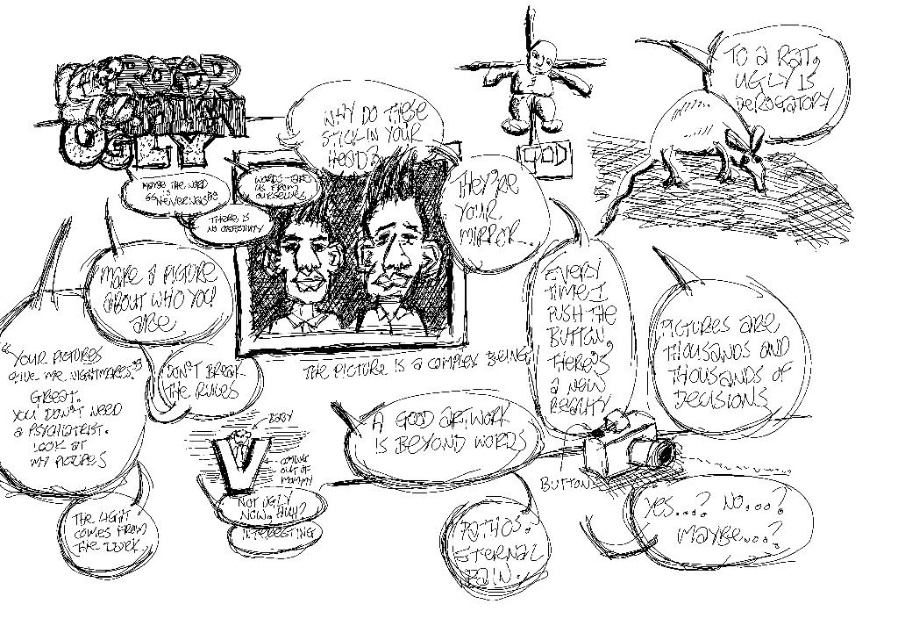
Based on the scene description, what is located at the coordinates point (x=395, y=244)?

The point (x=395, y=244) corresponds to the grayscale sketch portrait at center.

You are an artist analyzing the sketch. You notice two points marked in the image. The first point is at coordinates point (x=417, y=196) and the second is at point (x=275, y=269). Which point is closer to the viewer?

Point (x=417, y=196) is further to the viewer than point (x=275, y=269), so the second point is closer.

You are an art student analyzing the sketch. You need to locate the grayscale sketch portrait at center. According to the coordinates provided, where exactly is it positioned?

The grayscale sketch portrait at center is located at point coordinates 0.384 on the x axis and 0.441 on the y axis.